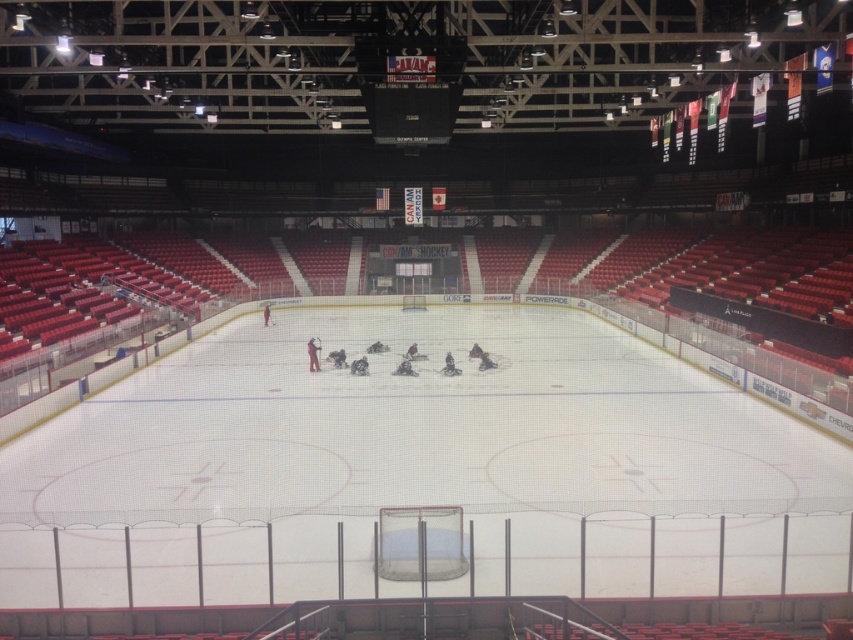
Question: Which object is the farthest from the black matte hockey stick at center?

Choices:
 (A) white matte hockey at center
 (B) white smooth ice at center
 (C) dark blue jersey at center

Answer: (B)

Question: Which of the following is the closest to the observer?

Choices:
 (A) dark blue jersey at center
 (B) white matte hockey at center

Answer: (A)

Question: From the image, what is the correct spatial relationship of dark blue jersey at center in relation to white matte hockey at center?

Choices:
 (A) left
 (B) right

Answer: (A)

Question: Among these objects, which one is nearest to the camera?

Choices:
 (A) black matte hockey stick at center
 (B) dark blue jersey at center

Answer: (B)

Question: Can you confirm if dark blue jersey at center is positioned to the right of white matte hockey at center?

Choices:
 (A) yes
 (B) no

Answer: (B)

Question: Does white smooth ice at center lie in front of black matte hockey stick at center?

Choices:
 (A) yes
 (B) no

Answer: (A)